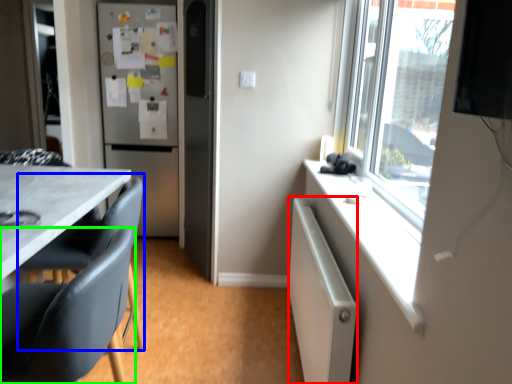
Question: Which object is the farthest from cabinetry (highlighted by a red box)? Choose among these: swivel chair (highlighted by a blue box) or chair (highlighted by a green box).

Choices:
 (A) swivel chair
 (B) chair

Answer: (A)